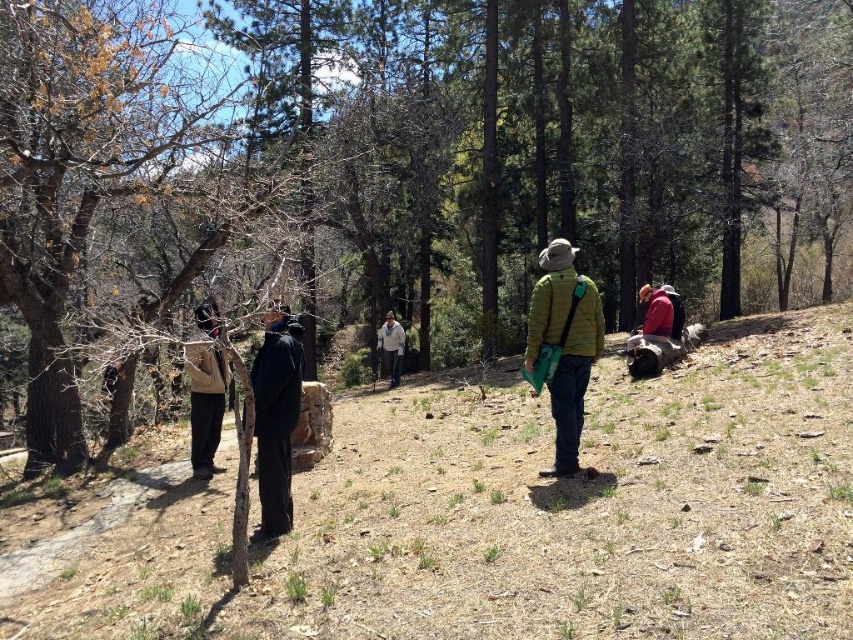
Is green matte jacket at center closer to camera compared to red woolen sweater at center?

Yes.

Consider the image. Between green matte jacket at center and red woolen sweater at center, which one appears on the right side from the viewer's perspective?

Positioned to the right is red woolen sweater at center.

Is point (572, 337) closer to viewer compared to point (654, 330)?

Yes.

Identify the location of green matte jacket at center. The image size is (853, 640). (563, 346).

Between point (260, 353) and point (648, 305), which one is positioned in front?

Point (260, 353)

Is point (267, 486) positioned after point (645, 298)?

That is False.

Where is `black matte jacket at center`? Image resolution: width=853 pixels, height=640 pixels. black matte jacket at center is located at coordinates [x=276, y=419].

Who is lower down, black matte jacket at center or beige fabric jacket at left?

beige fabric jacket at left is lower down.

Can you confirm if black matte jacket at center is smaller than beige fabric jacket at left?

Indeed, black matte jacket at center has a smaller size compared to beige fabric jacket at left.

The width and height of the screenshot is (853, 640). I want to click on black matte jacket at center, so click(276, 419).

This screenshot has width=853, height=640. I want to click on black matte jacket at center, so click(x=276, y=419).